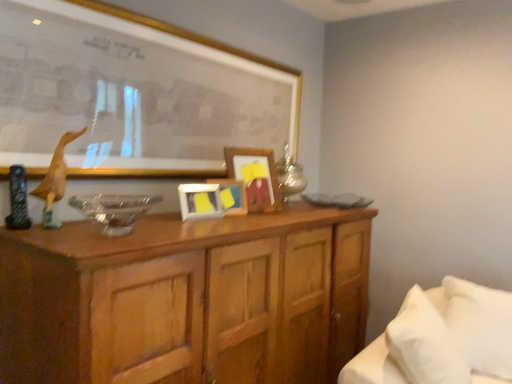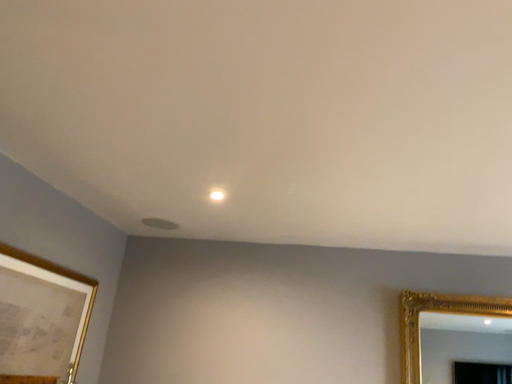
Question: How did the camera likely rotate when shooting the video?

Choices:
 (A) rotated left
 (B) rotated right

Answer: (B)